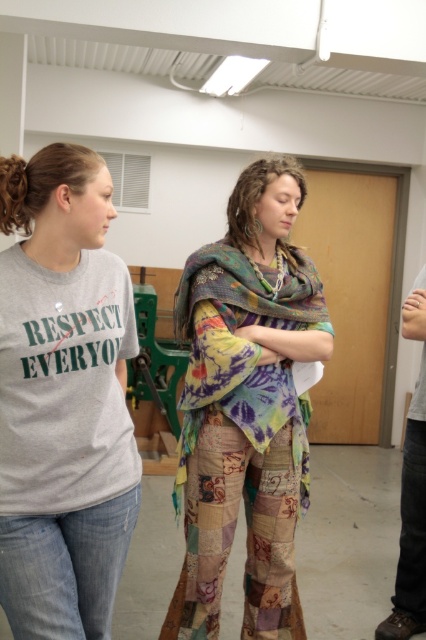
You are organizing a clothing donation drive and need to stack these items neatly. Given that both the patchwork fabric scarf at center and the textured multicolored shawl at center are on a table, which item should you place on top to ensure stability?

The textured multicolored shawl at center should be placed on top because the patchwork fabric scarf at center is currently positioned under it, indicating it can support the weight more effectively.